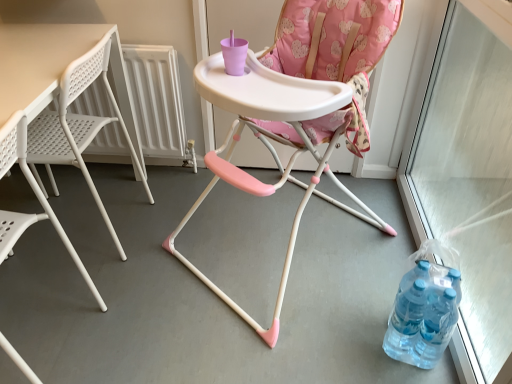
At what (x,y) coordinates should I click in order to perform the action: click on vacant space in white plastic table at left (from a real-world perspective). Please return your answer as a coordinate pair (x, y). The height and width of the screenshot is (384, 512). Looking at the image, I should click on (92, 226).